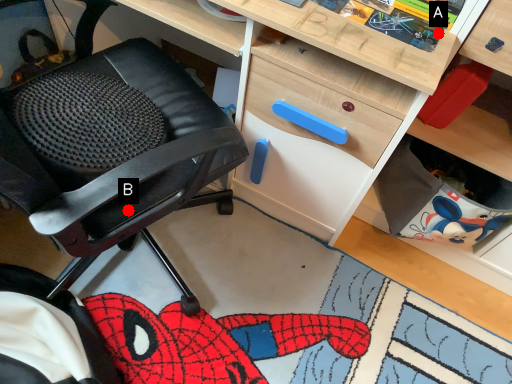
Question: Two points are circled on the image, labeled by A and B beside each circle. Which point is farther from the camera taking this photo?

Choices:
 (A) A is further
 (B) B is further

Answer: (A)